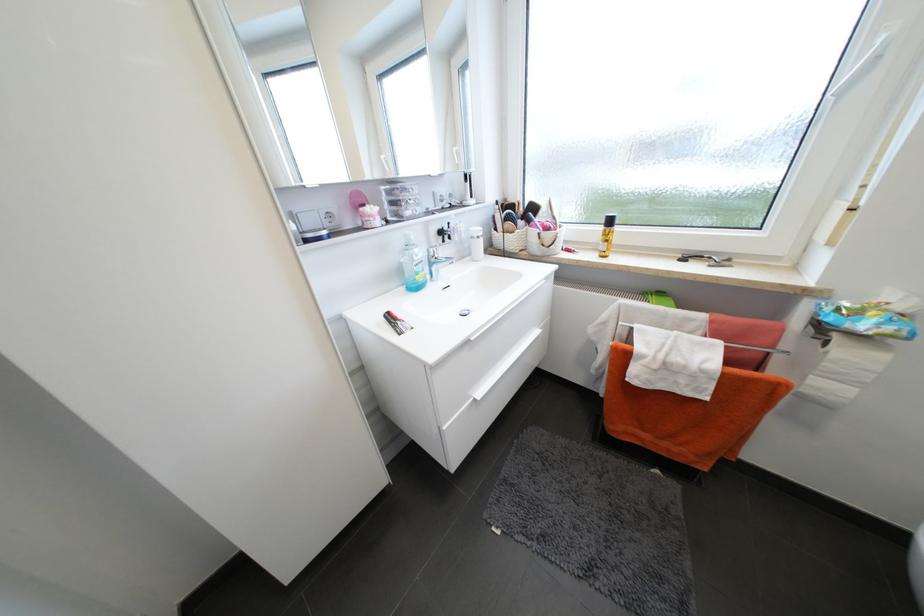
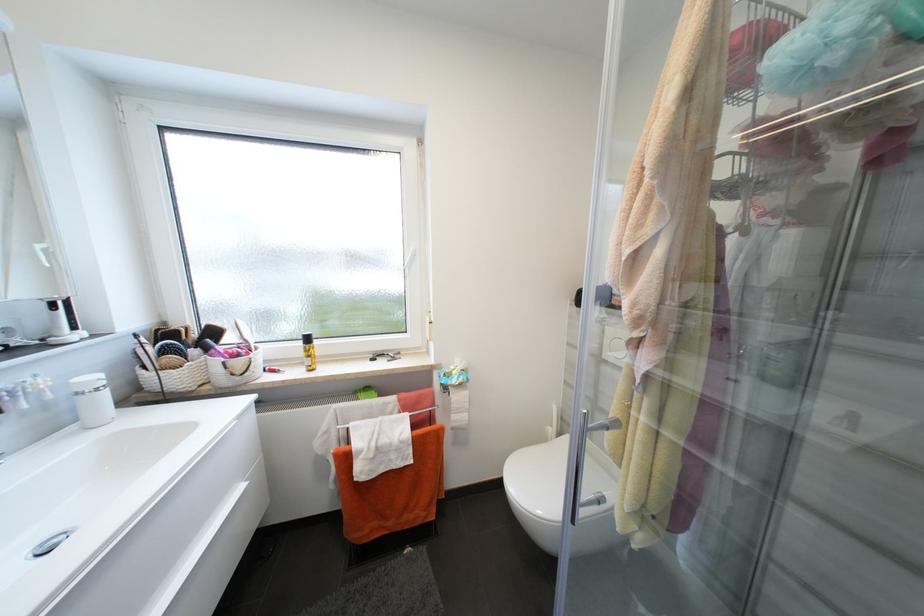
Question: The camera is either moving clockwise (left) or counter-clockwise (right) around the object. The first image is from the beginning of the video and the second image is from the end. Is the camera moving left or right when shooting the video?

Choices:
 (A) Left
 (B) Right

Answer: (A)